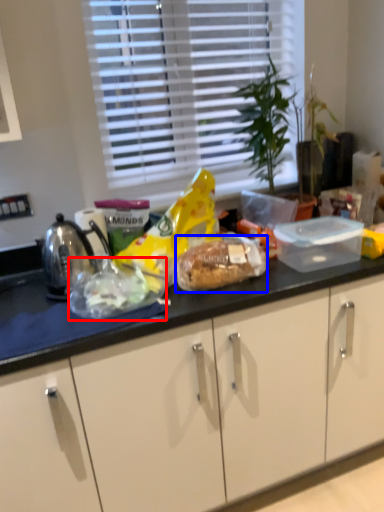
Question: Which object appears closest to the camera in this image, food (highlighted by a red box) or snack (highlighted by a blue box)?

Choices:
 (A) food
 (B) snack

Answer: (A)